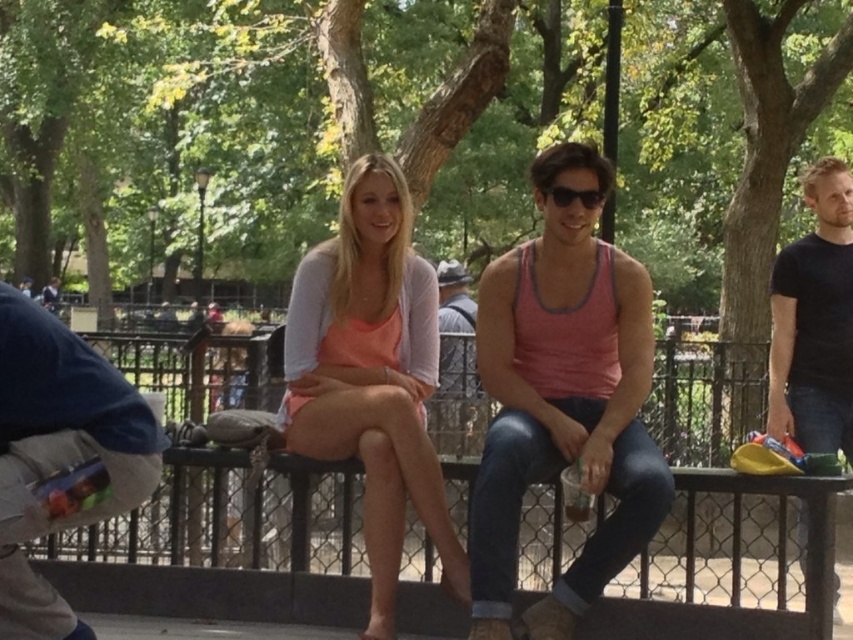
Can you confirm if black metal fence at center is thinner than striped fabric shirt at center?

No, black metal fence at center is not thinner than striped fabric shirt at center.

Describe the element at coordinates (711, 467) in the screenshot. I see `black metal fence at center` at that location.

Where is `black metal fence at center`? This screenshot has width=853, height=640. black metal fence at center is located at coordinates (711, 467).

Which is below, pink fabric tank top at center or matte peach tank top at center?

pink fabric tank top at center

Is point (498, 332) closer to camera compared to point (399, 211)?

Yes, point (498, 332) is closer to viewer.

Locate an element on the screen. The height and width of the screenshot is (640, 853). pink fabric tank top at center is located at coordinates (563, 400).

Who is taller, black metal fence at center or dark blue t-shirt at right?

With more height is black metal fence at center.

Based on the photo, is black metal fence at center positioned at the back of dark blue t-shirt at right?

No, black metal fence at center is closer to the viewer.

Identify the location of black metal fence at center. The image size is (853, 640). (711, 467).

I want to click on black metal fence at center, so click(x=711, y=467).